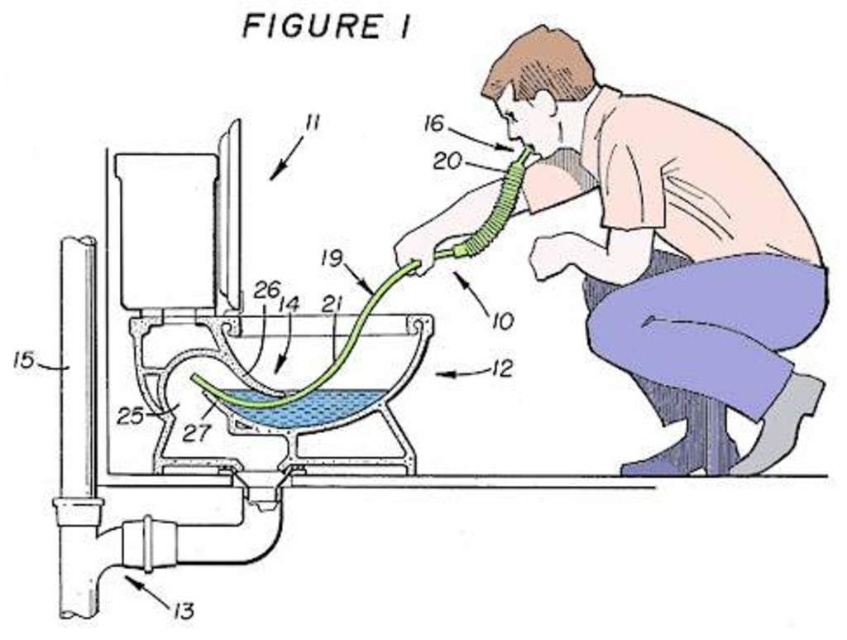
Question: From the image, what is the correct spatial relationship of pink fabric shirt at upper right in relation to green rubber hose at center?

Choices:
 (A) left
 (B) right

Answer: (B)

Question: Is pink fabric shirt at upper right below green rubber hose at center?

Choices:
 (A) yes
 (B) no

Answer: (B)

Question: Which object is farther from the camera taking this photo?

Choices:
 (A) green rubber hose at center
 (B) pink fabric shirt at upper right

Answer: (A)

Question: Which point is closer to the camera?

Choices:
 (A) (394, 282)
 (B) (690, 250)

Answer: (B)

Question: Which of the following is the farthest from the observer?

Choices:
 (A) pink fabric shirt at upper right
 (B) green rubber hose at center

Answer: (B)

Question: Can you confirm if pink fabric shirt at upper right is smaller than green rubber hose at center?

Choices:
 (A) yes
 (B) no

Answer: (B)